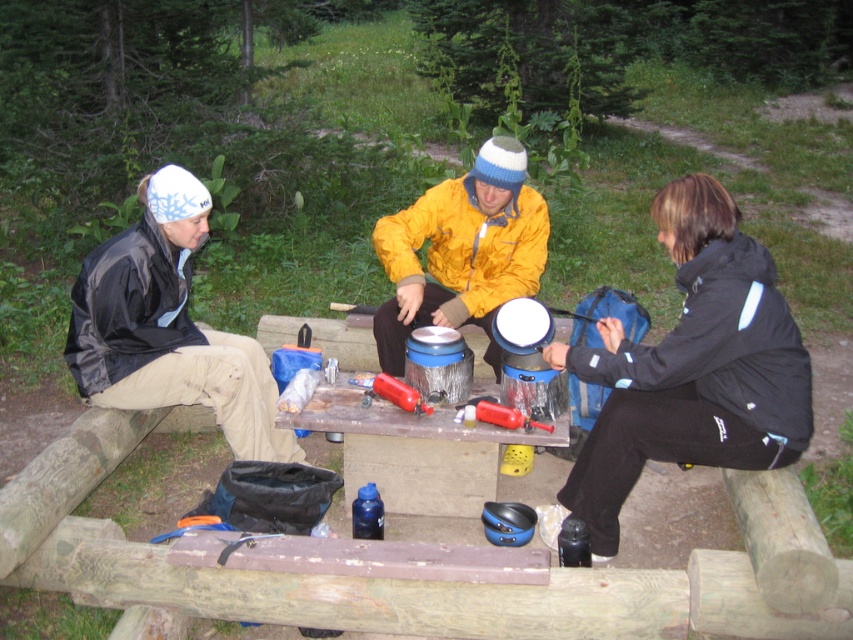
You are standing in front of the picnic table and notice two jackets. Which one is closer to you, the matte black jacket at left or the black matte jacket at left?

The matte black jacket at left is closer to the viewer than the black matte jacket at left.

You are standing at the far end of the picnic table and want to hand a snack to both the black matte jacket at left and the yellow matte jacket at center. Which person should you approach first if you want to reach the one closer to you?

The black matte jacket at left is below the yellow matte jacket at center, meaning it is closer to you. You should approach the black matte jacket at left first.